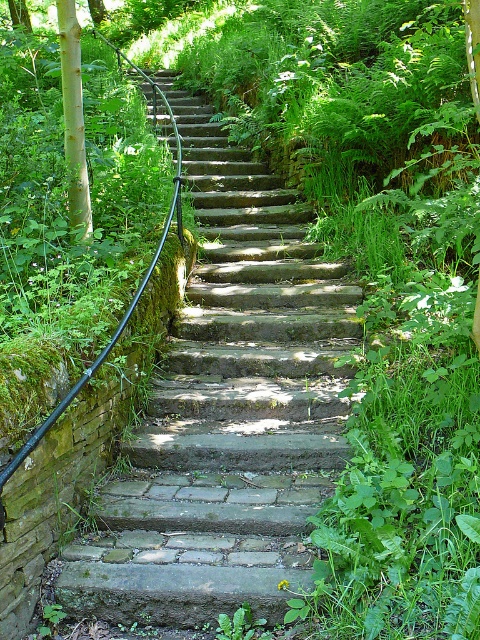
Is natural stone stairs at center closer to camera compared to smooth light brown tree trunk at left?

Yes, natural stone stairs at center is closer to the viewer.

Which is behind, point (277, 371) or point (75, 204)?

The point (277, 371) is behind.

Where is `natural stone stairs at center`? natural stone stairs at center is located at coordinates (228, 412).